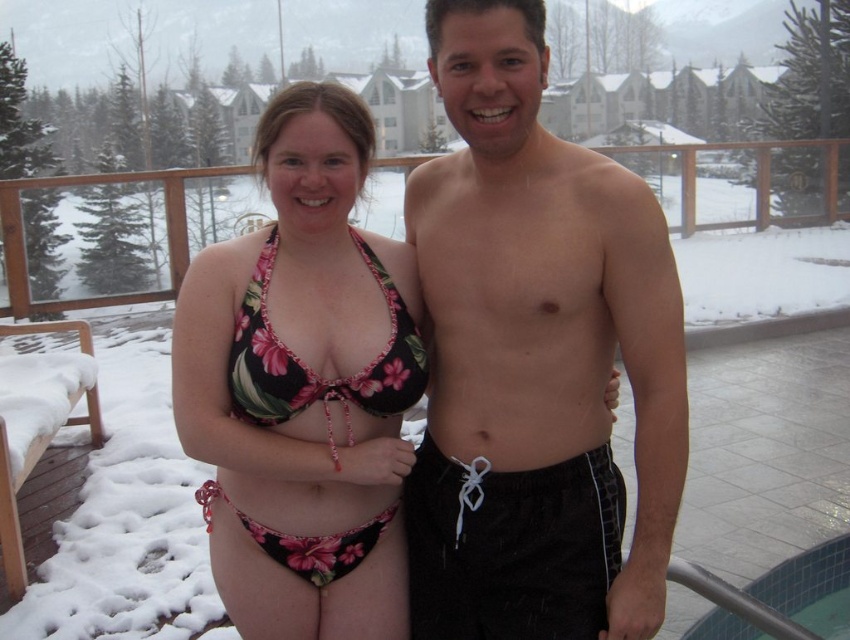
You are a photographer taking a photo of two people at a snowy resort. You notice the black fabric shorts at center and the floral print bikini top at center. Which of these two items is positioned higher on the person?

The black fabric shorts at center is taller than the floral print bikini top at center, so the black fabric shorts at center is positioned higher.

You are a photographer trying to capture the floral print bikini top at center and the black fabric at center in a clear shot. Which object is closer to the camera?

The floral print bikini top at center is positioned under the black fabric at center, so the black fabric at center is closer to the camera.